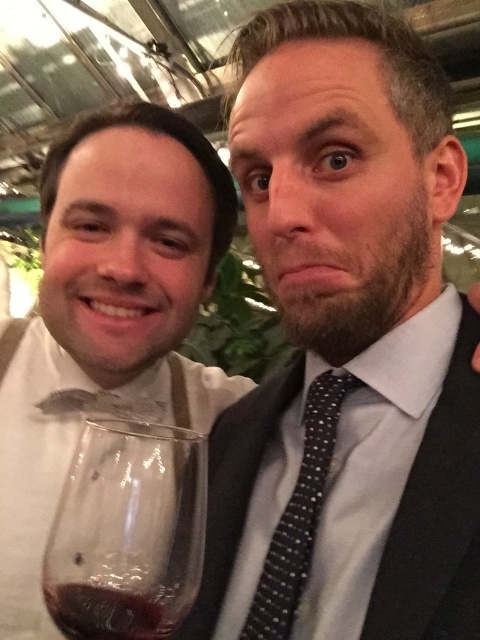
What do you see at coordinates (107, 317) in the screenshot?
I see `matte white bow tie at left` at bounding box center [107, 317].

Between matte white bow tie at left and black dotted tie at center, which one appears on the left side from the viewer's perspective?

matte white bow tie at left

Is point (117, 212) closer to viewer compared to point (307, 522)?

No, (117, 212) is behind (307, 522).

Where is `matte white bow tie at left`? Image resolution: width=480 pixels, height=640 pixels. matte white bow tie at left is located at coordinates (107, 317).

Who is positioned more to the left, matte white bow tie at left or black textured suit at center?

Positioned to the left is matte white bow tie at left.

Does point (177, 330) lie behind point (273, 422)?

Yes, point (177, 330) is farther from viewer.

Locate an element on the screen. The height and width of the screenshot is (640, 480). matte white bow tie at left is located at coordinates (107, 317).

Does transparent glass at lower left have a greater width compared to dark red liquid at lower left?

Yes, transparent glass at lower left is wider than dark red liquid at lower left.

Does transparent glass at lower left have a greater height compared to dark red liquid at lower left?

Yes.

Is point (82, 468) in front of point (59, 586)?

No.

Identify the location of transparent glass at lower left. The image size is (480, 640). (128, 531).